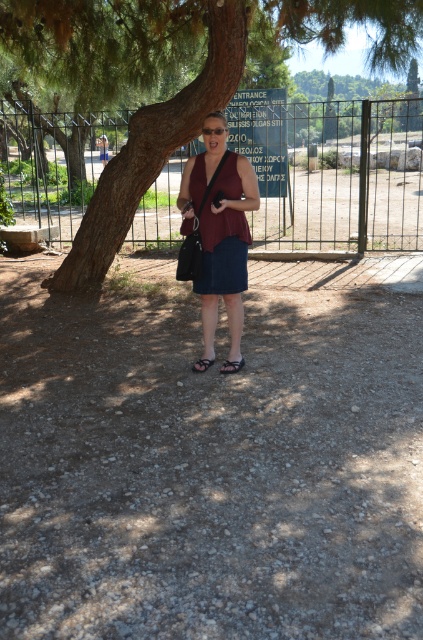
You are a photographer trying to capture a photo of the green leafy tree at center and the matte black shoulder bag at center. Which object should you focus on first if you want to ensure both are in sharp focus, considering their sizes?

The green leafy tree at center is bigger than the matte black shoulder bag at center, so you should focus on the larger object first to ensure both are in sharp focus.

You are a photographer setting up a shot of the person under the green leafy tree at center. The matte black shoulder bag at center is in the way of the perfect composition. Can you estimate whether the tree is wider than the bag to decide if moving the bag will help frame the person better?

The green leafy tree at center is wider than the matte black shoulder bag at center, so moving the bag will help frame the person better.